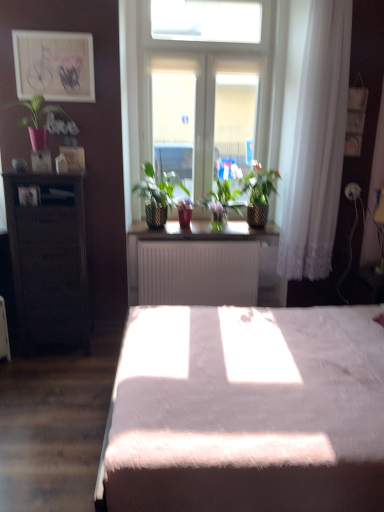
Question: Could you tell me if white fluffy bed at center is turned towards matte wooden picture frame at upper left?

Choices:
 (A) no
 (B) yes

Answer: (A)

Question: Is white fluffy bed at center positioned before matte wooden picture frame at upper left?

Choices:
 (A) yes
 (B) no

Answer: (A)

Question: Does white fluffy bed at center appear on the right side of matte wooden picture frame at upper left?

Choices:
 (A) no
 (B) yes

Answer: (B)

Question: From a real-world perspective, is white fluffy bed at center on matte wooden picture frame at upper left?

Choices:
 (A) no
 (B) yes

Answer: (A)

Question: Is matte wooden picture frame at upper left located within white fluffy bed at center?

Choices:
 (A) no
 (B) yes

Answer: (A)

Question: Is white fluffy bed at center positioned with its back to matte wooden picture frame at upper left?

Choices:
 (A) yes
 (B) no

Answer: (B)

Question: Is white glass window at center inside matte wooden picture frame at upper left?

Choices:
 (A) no
 (B) yes

Answer: (A)

Question: From a real-world perspective, is matte wooden picture frame at upper left beneath white glass window at center?

Choices:
 (A) yes
 (B) no

Answer: (B)

Question: Does matte wooden picture frame at upper left have a greater height compared to white glass window at center?

Choices:
 (A) yes
 (B) no

Answer: (B)

Question: From a real-world perspective, is matte wooden picture frame at upper left positioned over white glass window at center based on gravity?

Choices:
 (A) yes
 (B) no

Answer: (A)

Question: Is matte wooden picture frame at upper left looking in the opposite direction of white glass window at center?

Choices:
 (A) no
 (B) yes

Answer: (A)

Question: Considering the relative positions of matte wooden picture frame at upper left and white glass window at center in the image provided, is matte wooden picture frame at upper left to the left of white glass window at center from the viewer's perspective?

Choices:
 (A) yes
 (B) no

Answer: (A)

Question: Can you confirm if green matte plant at center, which is the second houseplant in right-to-left order, is bigger than white glass window at center?

Choices:
 (A) yes
 (B) no

Answer: (B)